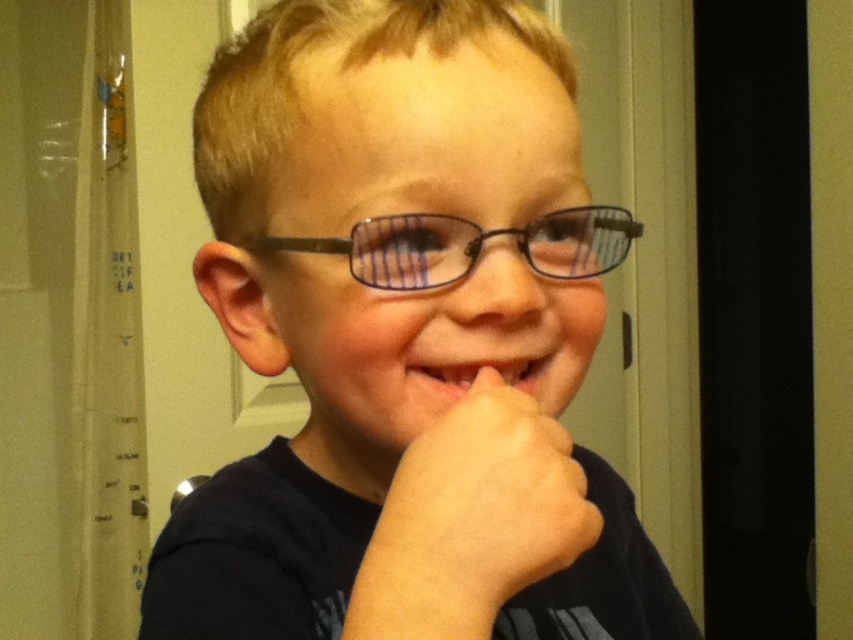
Question: Which point is closer to the camera?

Choices:
 (A) matte black glasses at center
 (B) black plastic glasses at center
 (C) pink glossy lips at center

Answer: (A)

Question: Does matte black glasses at center appear on the left side of black plastic glasses at center?

Choices:
 (A) no
 (B) yes

Answer: (B)

Question: Among these points, which one is nearest to the camera?

Choices:
 (A) (349, 636)
 (B) (427, 358)

Answer: (A)

Question: Considering the relative positions of matte black glasses at center and pink glossy lips at center in the image provided, where is matte black glasses at center located with respect to pink glossy lips at center?

Choices:
 (A) left
 (B) right

Answer: (A)

Question: Is matte black glasses at center to the right of pink glossy lips at center from the viewer's perspective?

Choices:
 (A) yes
 (B) no

Answer: (B)

Question: Which of these objects is positioned closest to the black plastic glasses at center?

Choices:
 (A) matte black glasses at center
 (B) pink glossy lips at center

Answer: (B)